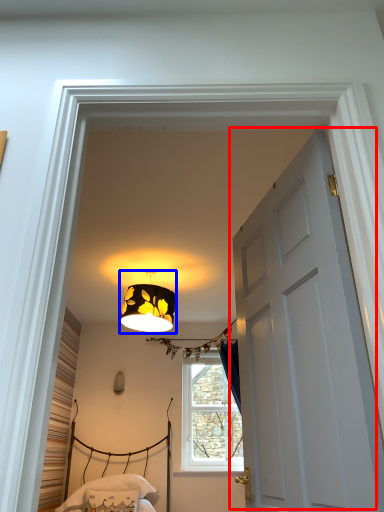
Question: Which object is closer to the camera taking this photo, door (highlighted by a red box) or lamp (highlighted by a blue box)?

Choices:
 (A) door
 (B) lamp

Answer: (A)